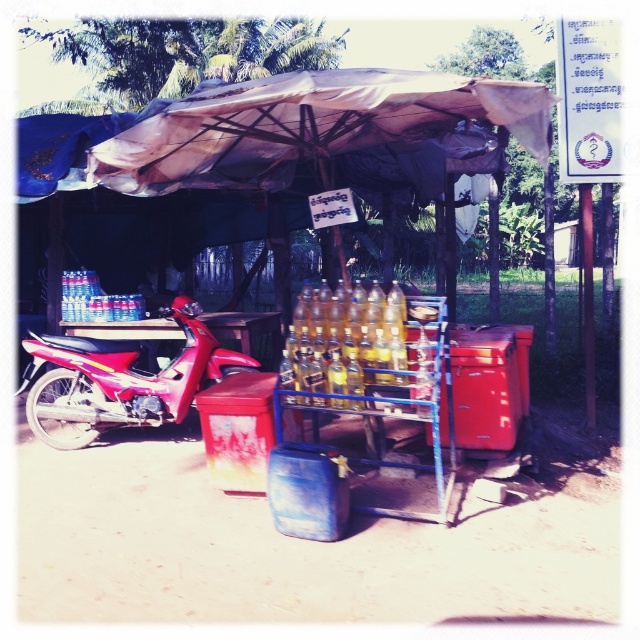
Question: Which object appears closest to the camera in this image?

Choices:
 (A) metallic red motorcycle at left
 (B) metallic blue cart at center
 (C) yellow glass bottles at center

Answer: (B)

Question: Is metallic blue cart at center to the left of metallic red motorcycle at left from the viewer's perspective?

Choices:
 (A) no
 (B) yes

Answer: (A)

Question: Which of the following is the closest to the observer?

Choices:
 (A) metallic blue cart at center
 (B) yellow glass bottles at center

Answer: (A)

Question: Can you confirm if metallic red motorcycle at left is positioned to the left of yellow glass bottles at center?

Choices:
 (A) yes
 (B) no

Answer: (A)

Question: Does metallic red motorcycle at left have a smaller size compared to yellow glass bottles at center?

Choices:
 (A) no
 (B) yes

Answer: (A)

Question: Estimate the real-world distances between objects in this image. Which object is farther from the metallic red motorcycle at left?

Choices:
 (A) yellow glass bottles at center
 (B) metallic blue cart at center

Answer: (A)